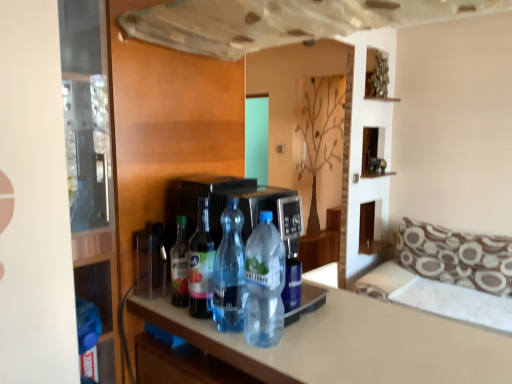
Find the location of a particular element. vacant space situated on the left part of clear plastic bottle at center, which ranks as the 1th bottle in right-to-left order is located at coordinates pyautogui.click(x=211, y=336).